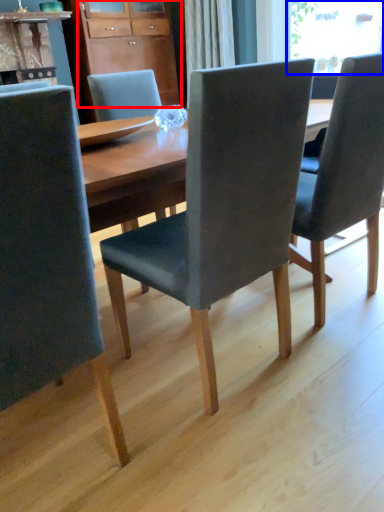
Question: Which point is further to the camera, cabinetry (highlighted by a red box) or window screen (highlighted by a blue box)?

Choices:
 (A) cabinetry
 (B) window screen

Answer: (A)